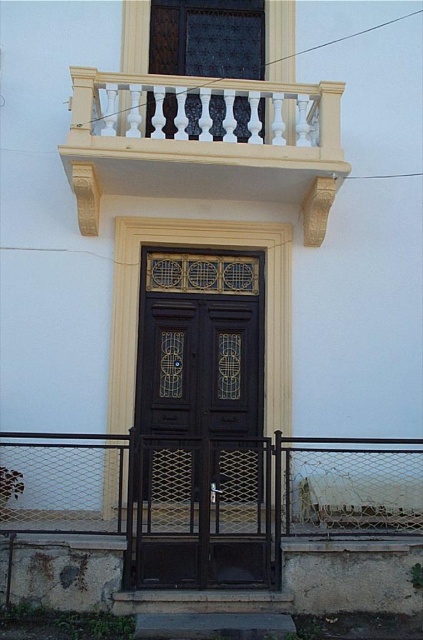
From the picture: Does dark wood door at center appear under white carved wood balcony at upper center?

Yes.

Where is `dark wood door at center`? dark wood door at center is located at coordinates (200, 422).